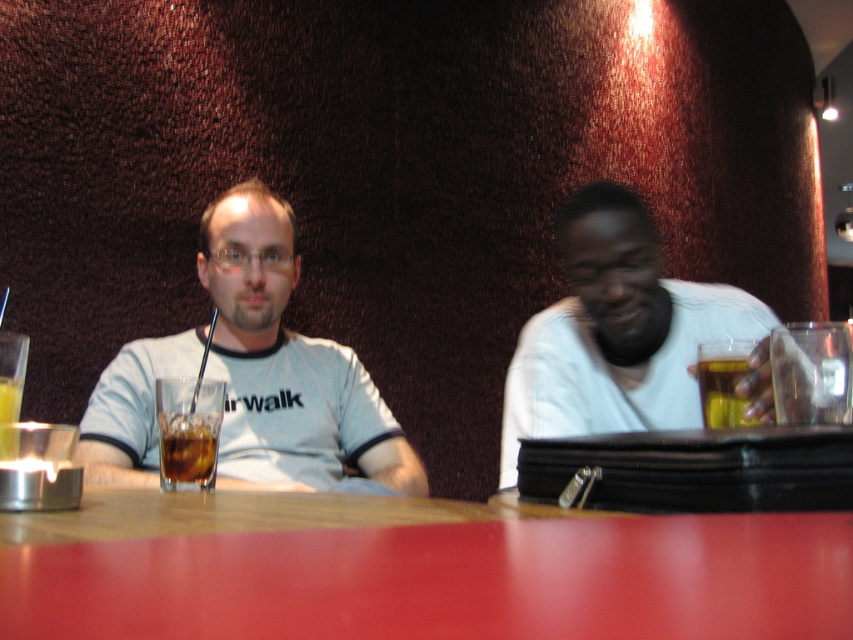
Is translucent glass beer at right to the right of translucent glass cup at lower left from the viewer's perspective?

Yes, translucent glass beer at right is to the right of translucent glass cup at lower left.

Where is `translucent glass beer at right`? The image size is (853, 640). translucent glass beer at right is located at coordinates (723, 384).

Which of these two, smooth wooden table at center or gray cotton shirt at center, stands shorter?

smooth wooden table at center is shorter.

Does smooth wooden table at center appear on the left side of gray cotton shirt at center?

In fact, smooth wooden table at center is to the right of gray cotton shirt at center.

This screenshot has height=640, width=853. I want to click on smooth wooden table at center, so tap(415, 570).

Is point (212, 467) behind point (7, 378)?

Yes.

Does point (181, 435) come closer to viewer compared to point (22, 381)?

Yes.

Is point (190, 483) closer to camera compared to point (6, 440)?

No, it is behind (6, 440).

The image size is (853, 640). In order to click on brown liquid at table front in this screenshot , I will do `click(187, 449)`.